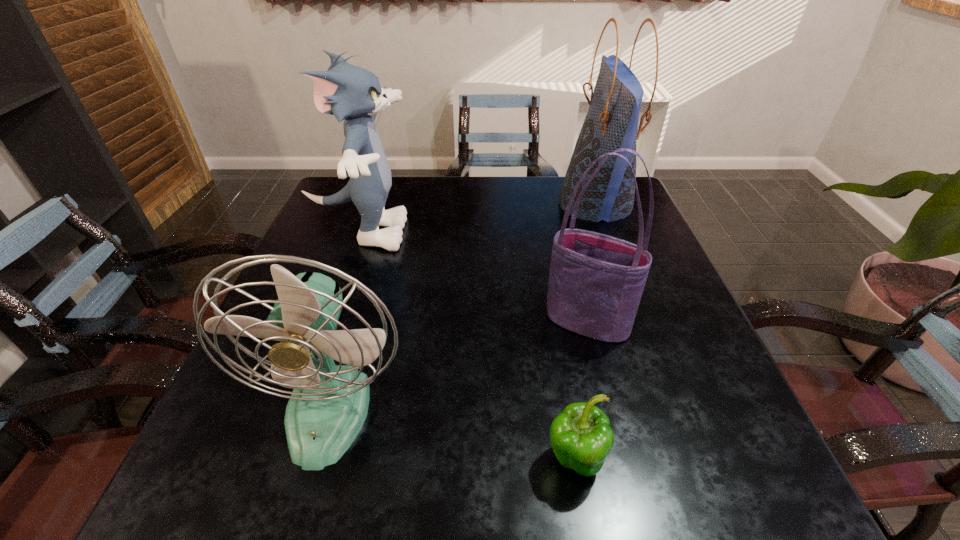
Where is `object positioned at the far right corner`? This screenshot has height=540, width=960. object positioned at the far right corner is located at coordinates (611, 123).

What are the coordinates of `free space at the far edge of the desktop` in the screenshot? It's located at 484,188.

Locate an element on the screen. blank area at the near edge is located at coordinates (431, 484).

The width and height of the screenshot is (960, 540). In order to click on free point at the left edge in this screenshot , I will do `click(276, 440)`.

The image size is (960, 540). Find the location of `blank area at the right edge`. blank area at the right edge is located at coordinates (670, 347).

The height and width of the screenshot is (540, 960). What are the coordinates of `vacant space at the near left corner of the desktop` in the screenshot? It's located at (256, 478).

In order to click on free spot at the near right corner of the desktop in this screenshot , I will do `click(674, 476)`.

In order to click on free spot between the cat and the shopping bag in this screenshot , I will do `click(478, 218)`.

Identify the location of free spot between the bell pepper and the cat. (467, 347).

I want to click on free space between the shortest object and the fan, so click(452, 434).